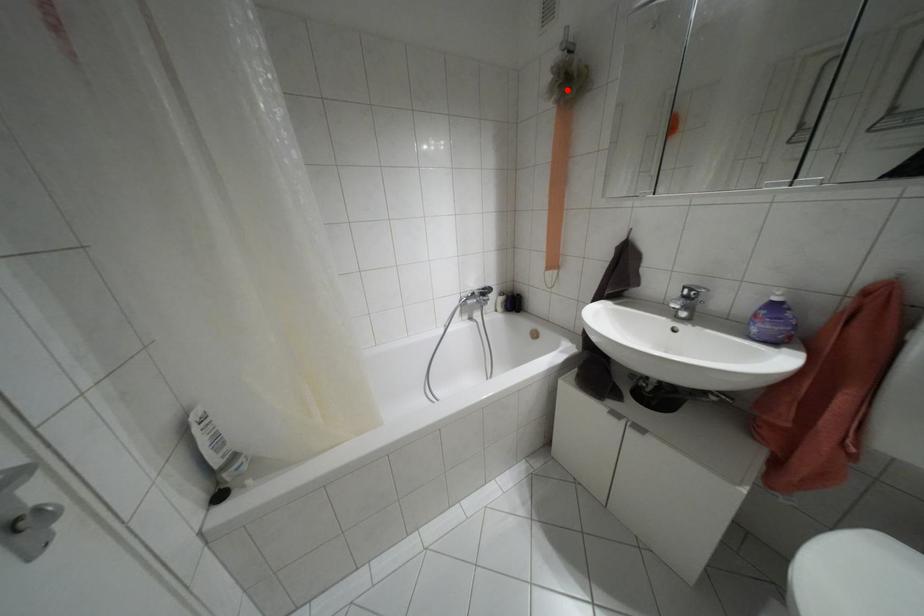
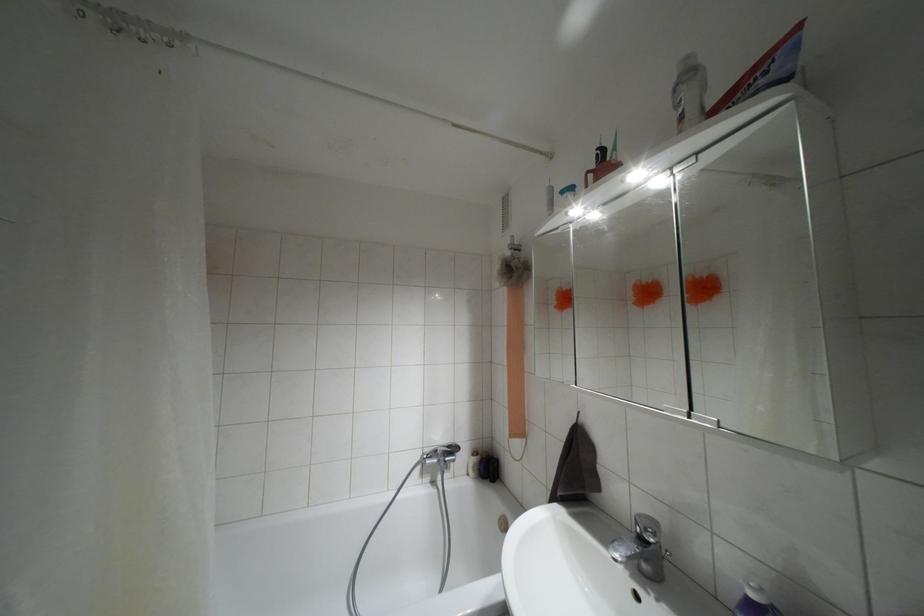
Question: I am providing you with two images of the same scene from different viewpoints. A red point is marked on the first image. Is the red point's position out of view in image 2?

Choices:
 (A) Yes
 (B) No

Answer: (B)